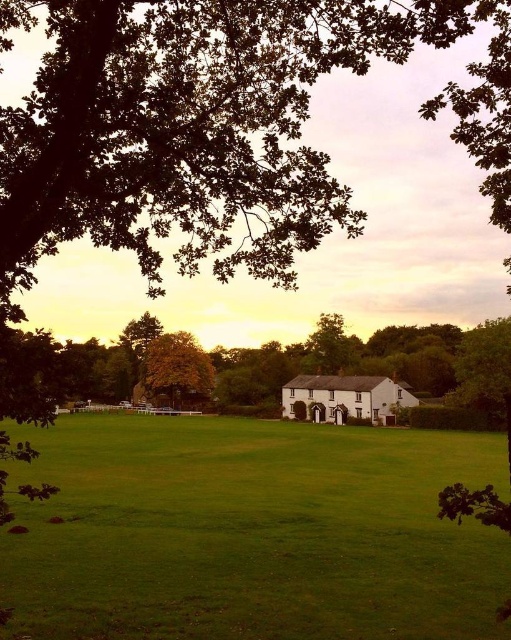
Does green grass field at center have a smaller size compared to green leafy tree at center?

Correct, green grass field at center occupies less space than green leafy tree at center.

Who is positioned more to the left, green grass field at center or green leafy tree at center?

Positioned to the left is green grass field at center.

Is point (274, 552) positioned after point (346, 356)?

No.

I want to click on green grass field at center, so point(252,532).

Measure the distance from green grass field at center to yellow-green leaves at center.

green grass field at center is 62.85 meters away from yellow-green leaves at center.

Is point (108, 550) behind point (183, 358)?

No, it is not.

Who is more distant from viewer, (242, 564) or (182, 397)?

Positioned behind is point (182, 397).

Locate an element on the screen. The width and height of the screenshot is (511, 640). green grass field at center is located at coordinates (252, 532).

Which is in front, point (71, 340) or point (151, 355)?

Point (71, 340) is more forward.

Is green leafy tree at center to the right of yellow-green leaves at center from the viewer's perspective?

Yes, green leafy tree at center is to the right of yellow-green leaves at center.

What do you see at coordinates (239, 365) in the screenshot? I see `green leafy tree at center` at bounding box center [239, 365].

Identify the location of green leafy tree at center. (239, 365).